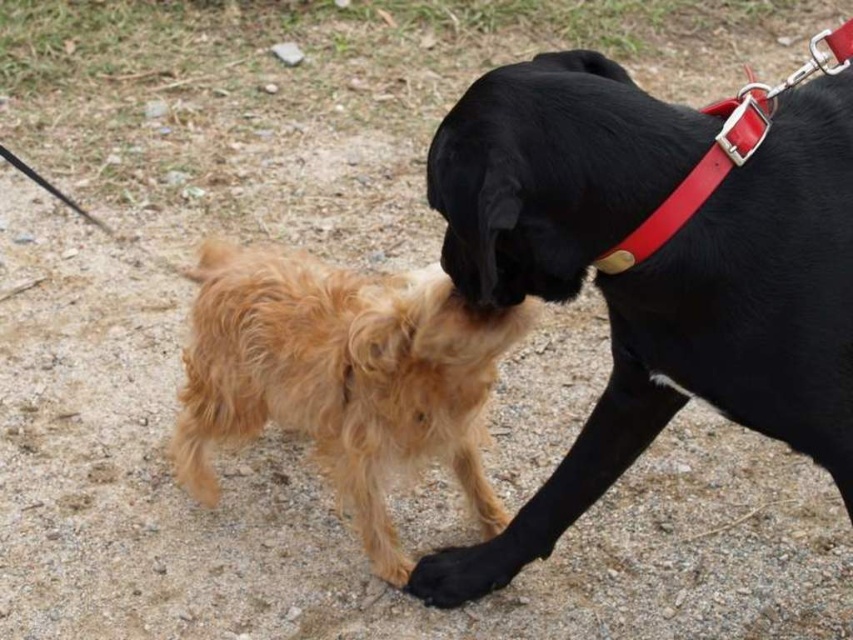
Between black smooth dog at upper right and golden fur dog at center, which one appears on the left side from the viewer's perspective?

From the viewer's perspective, golden fur dog at center appears more on the left side.

Describe the element at coordinates (712, 333) in the screenshot. I see `black smooth dog at upper right` at that location.

Image resolution: width=853 pixels, height=640 pixels. What do you see at coordinates (712, 333) in the screenshot?
I see `black smooth dog at upper right` at bounding box center [712, 333].

What are the coordinates of `black smooth dog at upper right` in the screenshot? It's located at (712, 333).